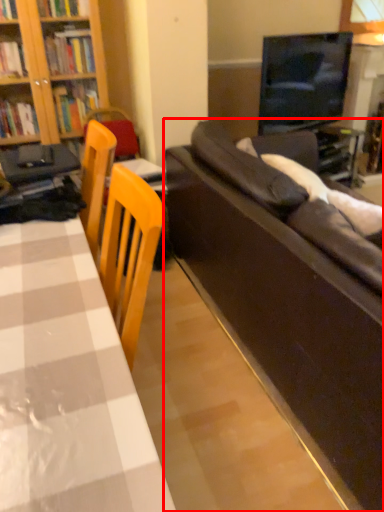
Question: From the image's perspective, considering the relative positions of studio couch (annotated by the red box) and table in the image provided, where is studio couch (annotated by the red box) located with respect to the staircase?

Choices:
 (A) above
 (B) below

Answer: (A)